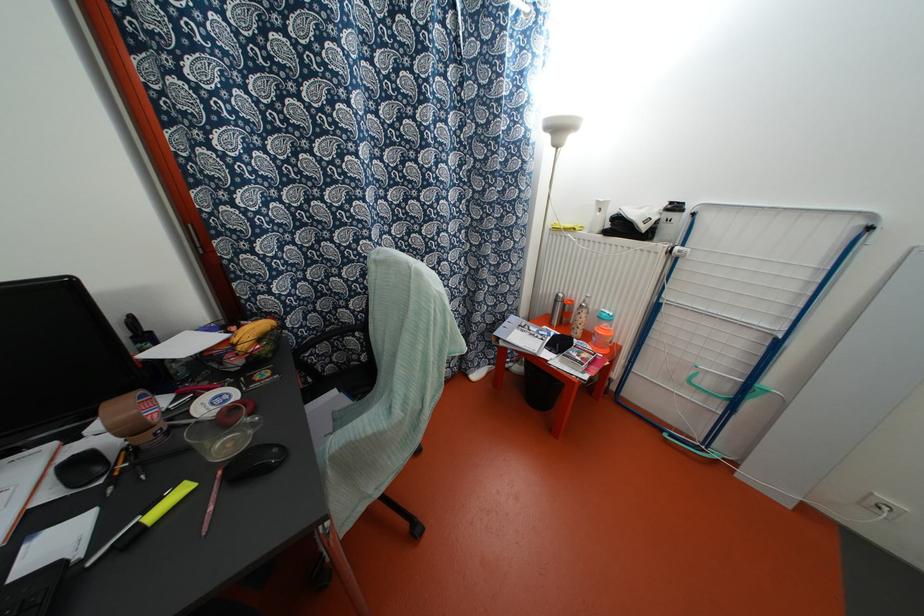
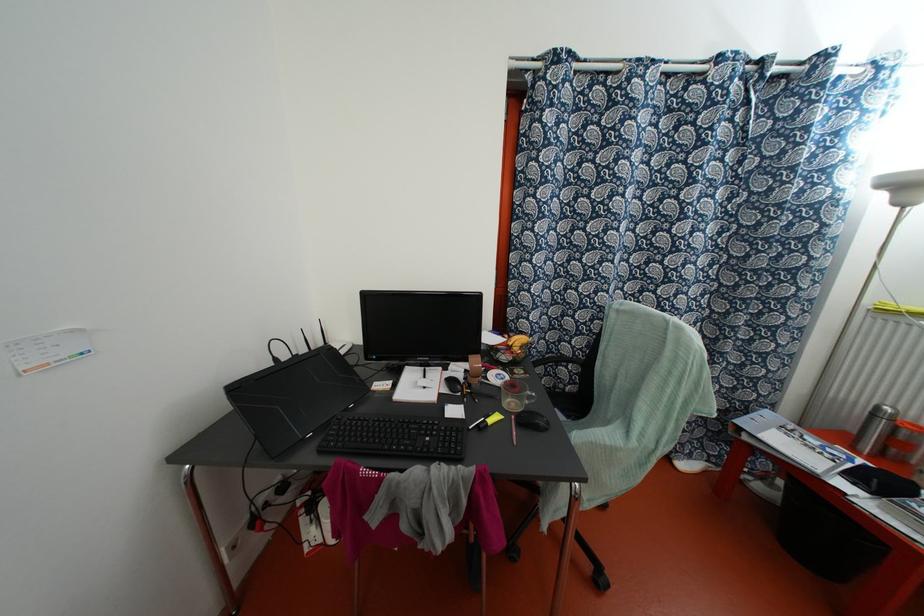
In the second image, find the point that corresponds to [554,301] in the first image.

(872, 415)